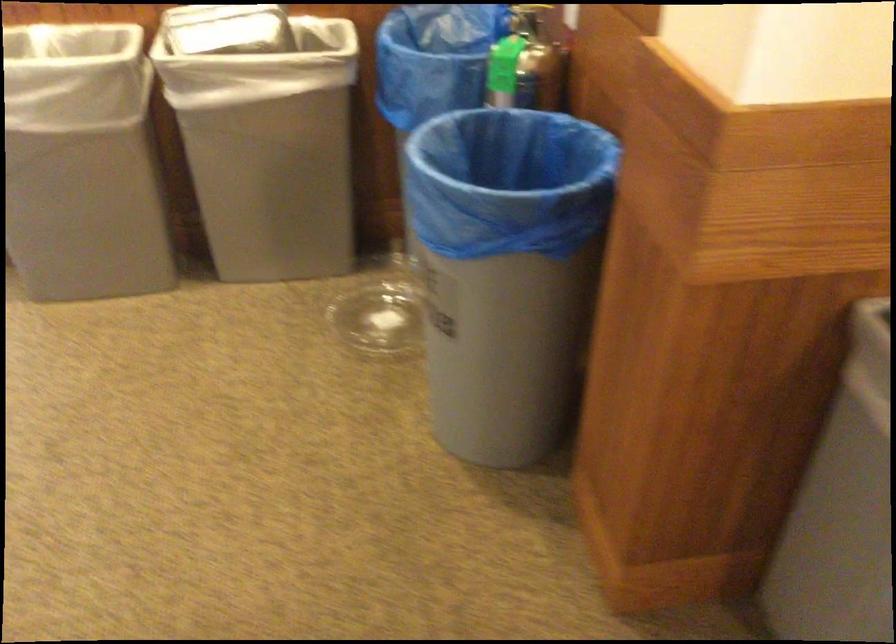
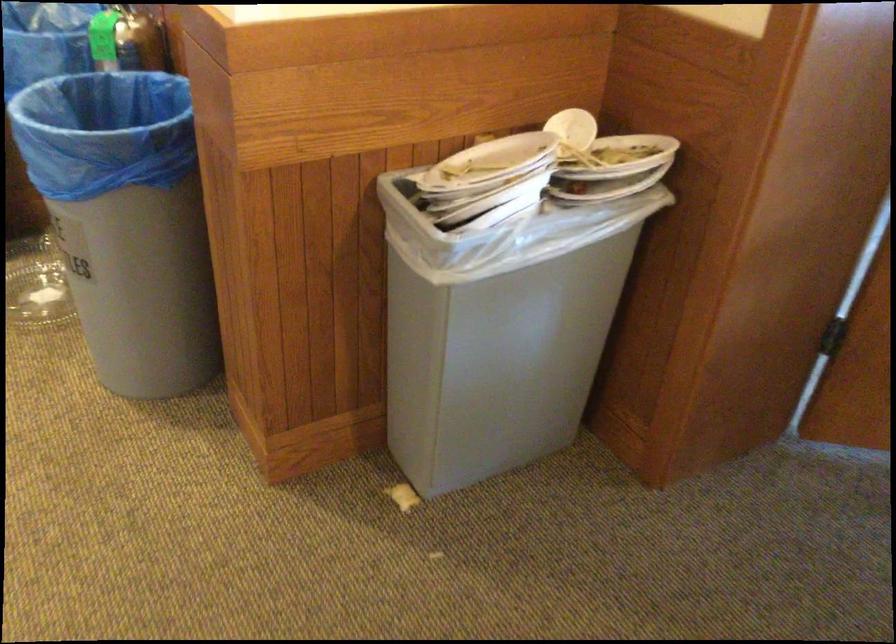
Find the pixel in the second image that matches (378,299) in the first image.

(36, 285)